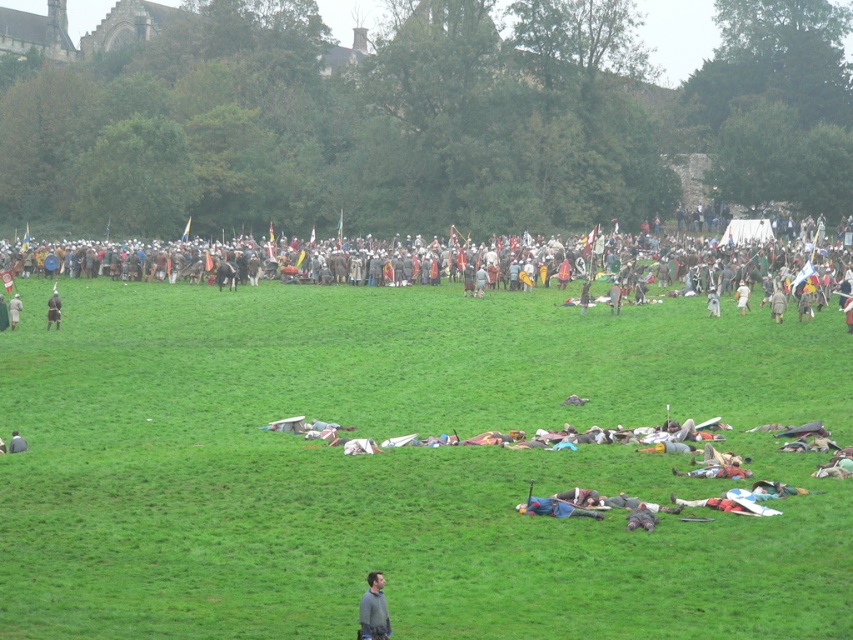
Which is below, green grass at center or metallic armor at center?

Positioned lower is green grass at center.

Is point (431, 298) positioned after point (706, 285)?

No, (431, 298) is closer to viewer.

Find the location of a particular element. green grass at center is located at coordinates (402, 465).

Does gray fabric shirt at lower center have a smaller size compared to matte black helmet at left?

No.

I want to click on gray fabric shirt at lower center, so click(x=374, y=609).

Where is `gray fabric shirt at lower center`? gray fabric shirt at lower center is located at coordinates (374, 609).

Which is more to the right, metallic armor at center or matte black helmet at left?

metallic armor at center is more to the right.

This screenshot has height=640, width=853. What do you see at coordinates (479, 266) in the screenshot?
I see `metallic armor at center` at bounding box center [479, 266].

Is point (184, 259) farther from camera compared to point (15, 300)?

Yes, point (184, 259) is farther from viewer.

This screenshot has height=640, width=853. What are the coordinates of `metallic armor at center` in the screenshot? It's located at (479, 266).